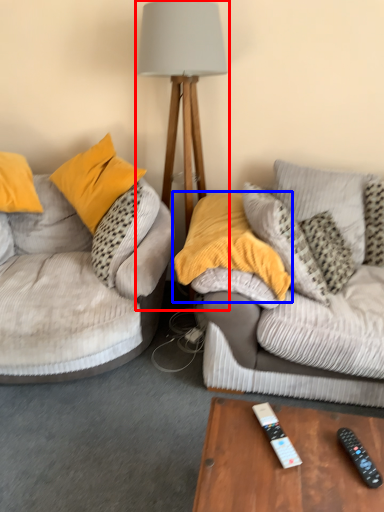
Question: Among these objects, which one is farthest to the camera, table lamp (highlighted by a red box) or pillow (highlighted by a blue box)?

Choices:
 (A) table lamp
 (B) pillow

Answer: (A)